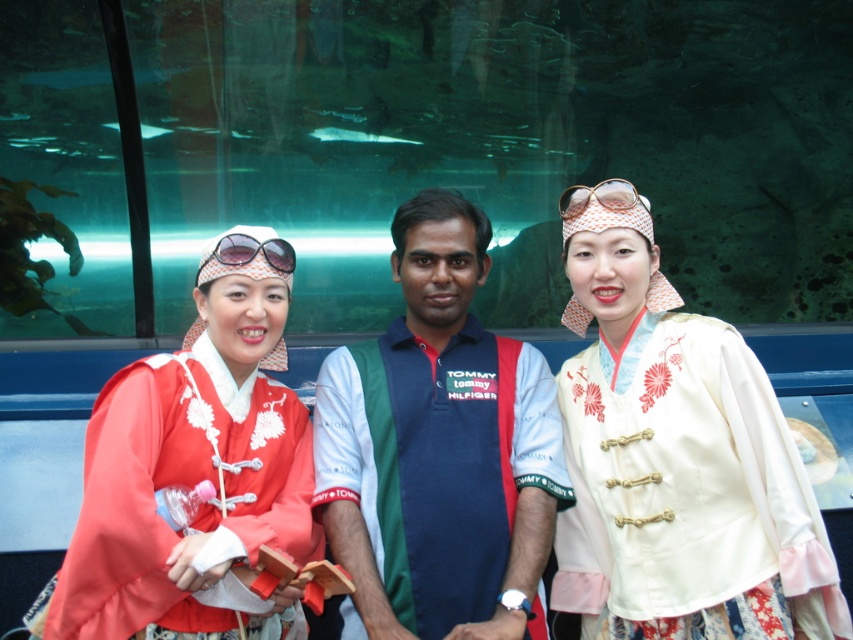
You are a photographer trying to capture a closeup of the white satin blouse at center and the sunglasses at center. Since the camera can only focus on one object at a time, which object should you choose to ensure it fills the frame more effectively?

The white satin blouse at center is bigger than the sunglasses at center, so choosing the white satin blouse at center will fill the frame more effectively.

Consider the image. You are standing at the center of the image and want to locate the blue cotton shirt at center. According to the coordinates provided, can you determine its exact position relative to the center?

The blue cotton shirt at center is located at coordinates point (439, 449), which means it is slightly to the right and above the center point of the image.